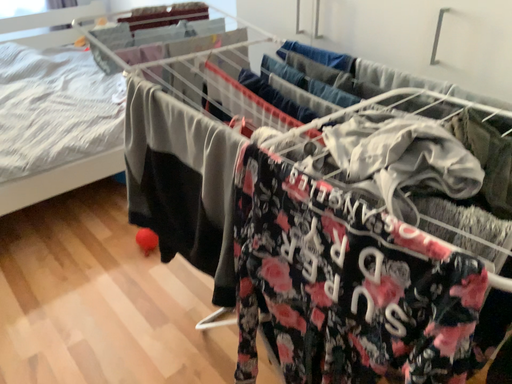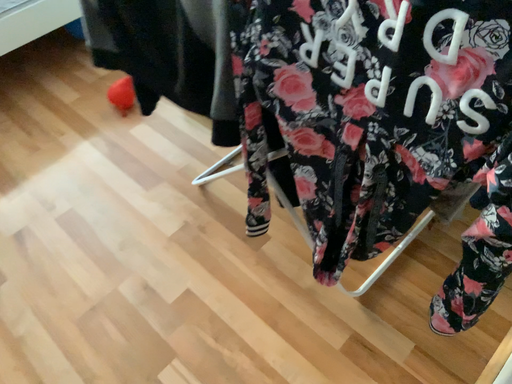
Question: How did the camera likely rotate when shooting the video?

Choices:
 (A) rotated upward
 (B) rotated downward

Answer: (B)